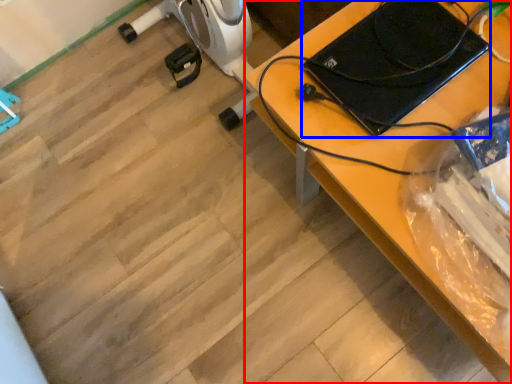
Question: Which object is closer to the camera taking this photo, desk (highlighted by a red box) or laptop (highlighted by a blue box)?

Choices:
 (A) desk
 (B) laptop

Answer: (A)